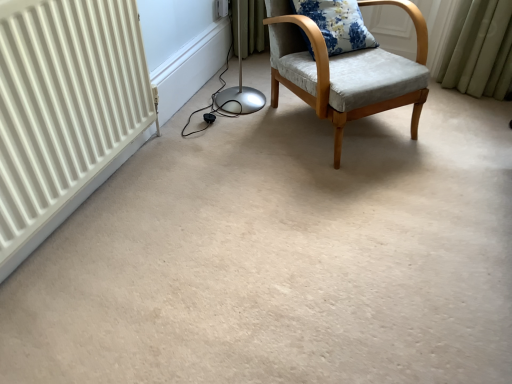
Image resolution: width=512 pixels, height=384 pixels. What do you see at coordinates (220, 9) in the screenshot? I see `white plastic electric outlet at upper center` at bounding box center [220, 9].

Where is `floral fabric cushion at upper right`? The image size is (512, 384). floral fabric cushion at upper right is located at coordinates (337, 24).

Measure the distance between point (361, 29) and camera.

6.46 feet.

Describe the element at coordinates (345, 71) in the screenshot. I see `light gray fabric chair at center` at that location.

Where is `white plastic electric outlet at upper center`? white plastic electric outlet at upper center is located at coordinates (220, 9).

Is white plastic electric outlet at upper center situated inside floral fabric cushion at upper right or outside?

white plastic electric outlet at upper center is outside floral fabric cushion at upper right.

Is white plastic electric outlet at upper center taller than floral fabric cushion at upper right?

In fact, white plastic electric outlet at upper center may be shorter than floral fabric cushion at upper right.

How different are the orientations of white plastic electric outlet at upper center and floral fabric cushion at upper right in degrees?

The angle between the facing direction of white plastic electric outlet at upper center and the facing direction of floral fabric cushion at upper right is 41.9 degrees.

From the image's perspective, who appears lower, white plastic electric outlet at upper center or floral fabric cushion at upper right?

floral fabric cushion at upper right is shown below in the image.

Considering the relative sizes of light gray fabric chair at center and white plastic electric outlet at upper center in the image provided, is light gray fabric chair at center smaller than white plastic electric outlet at upper center?

Incorrect, light gray fabric chair at center is not smaller in size than white plastic electric outlet at upper center.

Does point (330, 96) appear closer or farther from the camera than point (221, 16)?

Point (330, 96) is closer to the camera than point (221, 16).

Is light gray fabric chair at center further to the viewer compared to white plastic electric outlet at upper center?

No, it is not.

Considering the sizes of objects white plastic electric outlet at upper center and light gray fabric chair at center in the image provided, who is shorter, white plastic electric outlet at upper center or light gray fabric chair at center?

Standing shorter between the two is white plastic electric outlet at upper center.

What's the angular difference between white plastic electric outlet at upper center and light gray fabric chair at center's facing directions?

44.7 degrees separate the facing orientations of white plastic electric outlet at upper center and light gray fabric chair at center.

Looking at this image, does white plastic electric outlet at upper center turn towards light gray fabric chair at center?

Yes, white plastic electric outlet at upper center faces towards light gray fabric chair at center.

From a real-world perspective, which is physically above, white plastic electric outlet at upper center or light gray fabric chair at center?

In real-world perspective, light gray fabric chair at center is above.

This screenshot has width=512, height=384. What are the coordinates of `pillow below the white plastic electric outlet at upper center (from the image's perspective)` in the screenshot? It's located at (337, 24).

Does floral fabric cushion at upper right touch white plastic electric outlet at upper center?

floral fabric cushion at upper right and white plastic electric outlet at upper center are not in contact.

Based on the photo, considering the sizes of floral fabric cushion at upper right and white plastic electric outlet at upper center in the image, is floral fabric cushion at upper right bigger or smaller than white plastic electric outlet at upper center?

Considering their sizes, floral fabric cushion at upper right takes up more space than white plastic electric outlet at upper center.

Between floral fabric cushion at upper right and white plastic electric outlet at upper center, which one has more height?

Standing taller between the two is floral fabric cushion at upper right.

Considering the relative sizes of light gray fabric chair at center and floral fabric cushion at upper right in the image provided, is light gray fabric chair at center thinner than floral fabric cushion at upper right?

No, light gray fabric chair at center is not thinner than floral fabric cushion at upper right.

Is light gray fabric chair at center oriented towards floral fabric cushion at upper right?

Yes, light gray fabric chair at center is oriented towards floral fabric cushion at upper right.

Is the depth of light gray fabric chair at center greater than that of floral fabric cushion at upper right?

No, light gray fabric chair at center is closer to the viewer.

Where is `pillow that is on the left side of light gray fabric chair at center`? pillow that is on the left side of light gray fabric chair at center is located at coordinates [x=337, y=24].

Is light gray fabric chair at center at the back of floral fabric cushion at upper right?

Absolutely, floral fabric cushion at upper right is directed away from light gray fabric chair at center.

Does floral fabric cushion at upper right come in front of light gray fabric chair at center?

No, floral fabric cushion at upper right is further to the viewer.

From a real-world perspective, is floral fabric cushion at upper right on light gray fabric chair at center?

Yes, from a real-world perspective, floral fabric cushion at upper right is above light gray fabric chair at center.

Looking at this image, in the image, is floral fabric cushion at upper right on the left side or the right side of light gray fabric chair at center?

Clearly, floral fabric cushion at upper right is on the left of light gray fabric chair at center in the image.

Locate an element on the screen. Image resolution: width=512 pixels, height=384 pixels. electric outlet below the floral fabric cushion at upper right (from a real-world perspective) is located at coordinates (220, 9).

I want to click on chair in front of the white plastic electric outlet at upper center, so click(x=345, y=71).

Which object lies further to the anchor point white plastic electric outlet at upper center, floral fabric cushion at upper right or light gray fabric chair at center?

The object further to white plastic electric outlet at upper center is light gray fabric chair at center.

Which object lies nearer to the anchor point light gray fabric chair at center, floral fabric cushion at upper right or white plastic electric outlet at upper center?

floral fabric cushion at upper right is positioned closer to the anchor light gray fabric chair at center.

Considering their positions, is white plastic electric outlet at upper center positioned further to light gray fabric chair at center than floral fabric cushion at upper right?

white plastic electric outlet at upper center is positioned further to the anchor light gray fabric chair at center.

Considering their positions, is white plastic electric outlet at upper center positioned closer to floral fabric cushion at upper right than light gray fabric chair at center?

light gray fabric chair at center is positioned closer to the anchor floral fabric cushion at upper right.

Estimate the real-world distances between objects in this image. Which object is closer to floral fabric cushion at upper right, light gray fabric chair at center or white plastic electric outlet at upper center?

light gray fabric chair at center.

Based on their spatial positions, is light gray fabric chair at center or floral fabric cushion at upper right closer to white plastic electric outlet at upper center?

floral fabric cushion at upper right is closer to white plastic electric outlet at upper center.

This screenshot has height=384, width=512. I want to click on pillow positioned between light gray fabric chair at center and white plastic electric outlet at upper center from near to far, so click(337, 24).